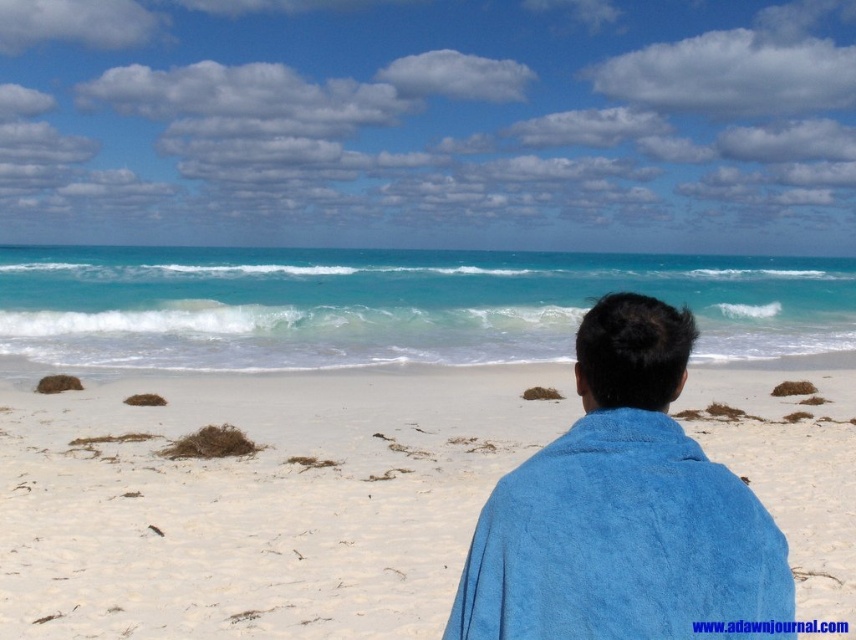
You are a photographer standing on the white sandy beach at center and want to place a blue towel at center for a photo shoot. The minimum distance required between the beach and the towel for the desired composition is 15 meters. Based on the scene description, will the current placement meet this requirement?

The white sandy beach at center and blue towel at center are 13.68 meters apart, which is less than the required 15 meters. Therefore, the current placement does not meet the distance requirement.

You are standing at point (259,500) on a beach map. What object is located at this coordinate?

The white sandy beach at center is located at point (259,500).